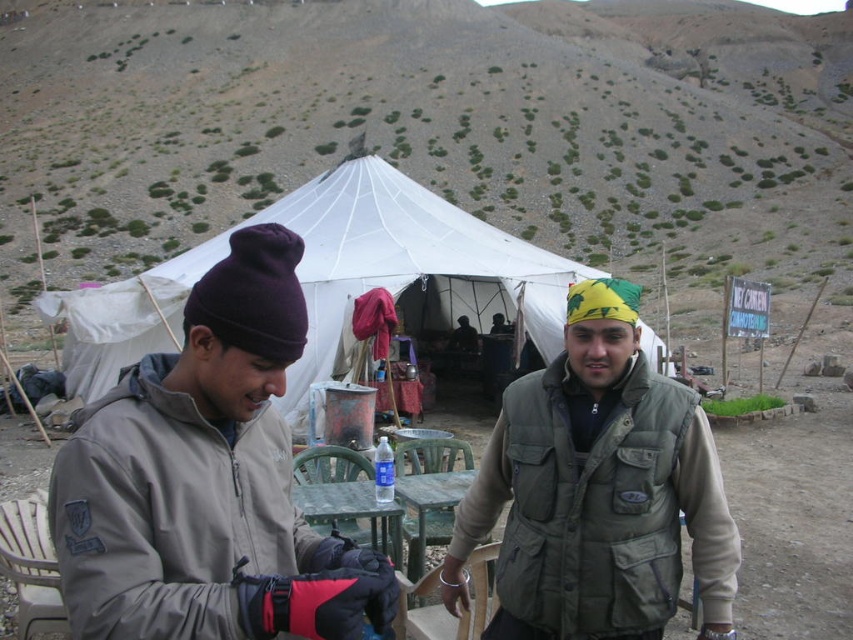
Question: Is gray fleece jacket at center to the left of green canvas yurt at center from the viewer's perspective?

Choices:
 (A) yes
 (B) no

Answer: (A)

Question: Which point is farther to the camera?

Choices:
 (A) (523, 637)
 (B) (393, 602)

Answer: (A)

Question: Which of the following is the farthest from the observer?

Choices:
 (A) (614, 324)
 (B) (432, 257)

Answer: (B)

Question: Estimate the real-world distances between objects in this image. Which object is farther from the gray fleece jacket at center?

Choices:
 (A) white canvas tent at center
 (B) green canvas yurt at center

Answer: (A)

Question: Does gray fleece jacket at center have a greater width compared to white canvas tent at center?

Choices:
 (A) yes
 (B) no

Answer: (B)

Question: Is green canvas yurt at center bigger than white canvas tent at center?

Choices:
 (A) no
 (B) yes

Answer: (A)